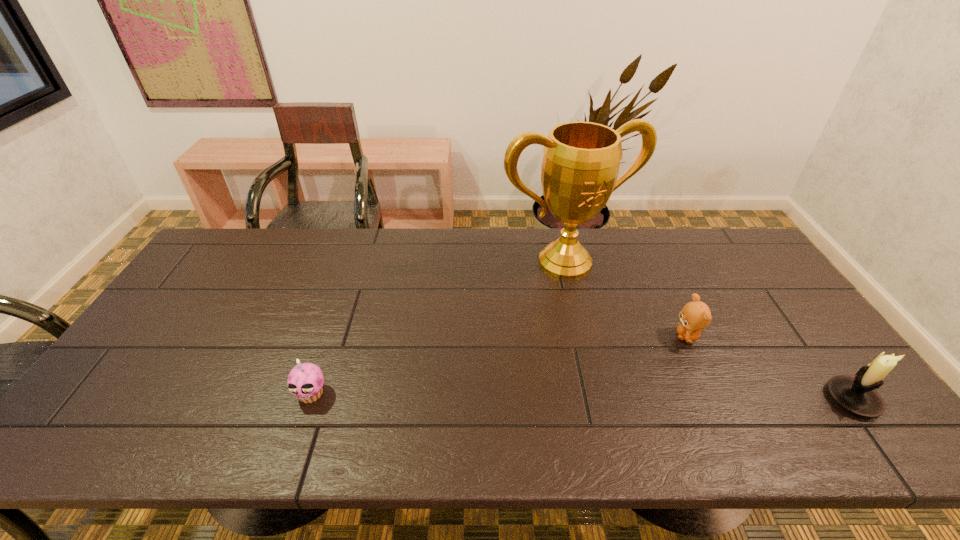
The image size is (960, 540). Find the location of `cupcake`. cupcake is located at coordinates (305, 381).

Find the location of `candle holder`. candle holder is located at coordinates (858, 395).

Where is `the second tallest object`? The image size is (960, 540). the second tallest object is located at coordinates (858, 395).

You are a GUI agent. You are given a task and a screenshot of the screen. Output one action in this format:
    pyautogui.click(x=<x>, y=<y>)
    Task: Click on the award
    
    Given the screenshot: What is the action you would take?
    pyautogui.click(x=581, y=161)

Find the location of a particular element. The width and height of the screenshot is (960, 540). the third object from right to left is located at coordinates (581, 161).

You are a GUI agent. You are given a task and a screenshot of the screen. Output one action in this format:
    pyautogui.click(x=<x>, y=<y>)
    Task: Click on the teddy bear
    The height and width of the screenshot is (540, 960).
    Given the screenshot: What is the action you would take?
    pyautogui.click(x=695, y=315)

Locate an element on the screen. the third object from left to right is located at coordinates (695, 315).

Image resolution: width=960 pixels, height=540 pixels. What are the coordinates of `vacant region located on the left of the rightmost object` in the screenshot? It's located at (716, 399).

I want to click on vacant point located on the front-facing side of the third object from right to left, so click(x=600, y=300).

Locate an element on the screen. This screenshot has width=960, height=540. free space located on the front-facing side of the third object from right to left is located at coordinates (613, 319).